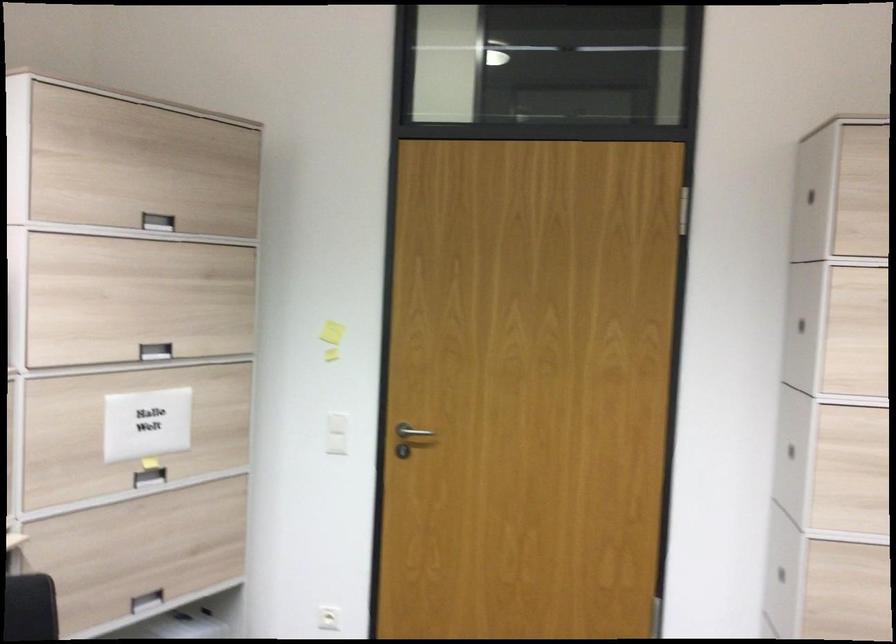
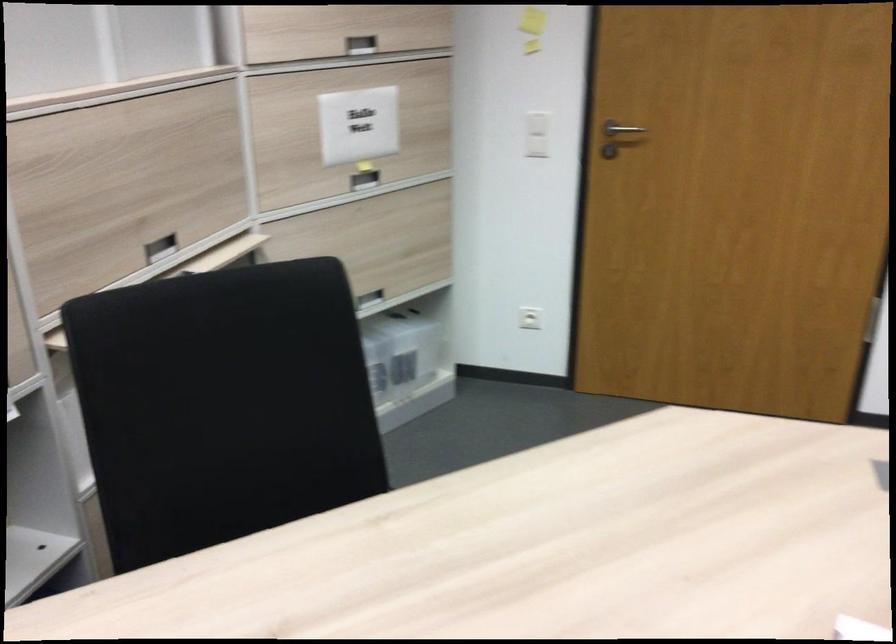
In the second image, find the point that corresponds to [147,422] in the first image.

(358, 125)